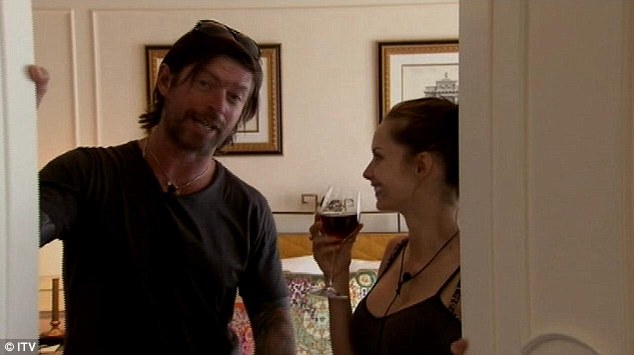
The height and width of the screenshot is (355, 634). I want to click on lamp, so click(x=49, y=263).